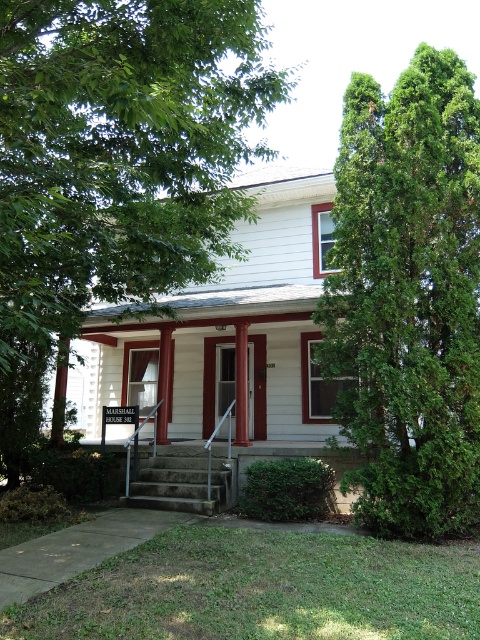
Question: Estimate the real-world distances between objects in this image. Which object is farther from the concrete stairs at center?

Choices:
 (A) smooth wood door at center
 (B) green textured evergreen tree at right

Answer: (B)

Question: Which point is closer to the camera?

Choices:
 (A) (156, 476)
 (B) (359, 353)
 (C) (247, 403)
 (D) (78, 65)

Answer: (D)

Question: Does concrete stairs at center have a lesser width compared to smooth wood door at center?

Choices:
 (A) no
 (B) yes

Answer: (A)

Question: Can you confirm if concrete stairs at center is wider than smooth wood door at center?

Choices:
 (A) no
 (B) yes

Answer: (B)

Question: Among these points, which one is farthest from the camera?

Choices:
 (A) (136, 273)
 (B) (213, 481)
 (C) (355, 396)

Answer: (B)

Question: In this image, where is green leafy tree at upper right located relative to green textured evergreen tree at right?

Choices:
 (A) below
 (B) above

Answer: (B)